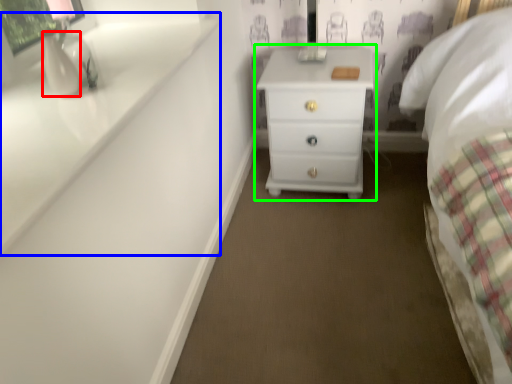
Question: Based on their relative distances, which object is nearer to vase (highlighted by a red box)? Choose from window sill (highlighted by a blue box) and chest of drawers (highlighted by a green box).

Choices:
 (A) window sill
 (B) chest of drawers

Answer: (A)